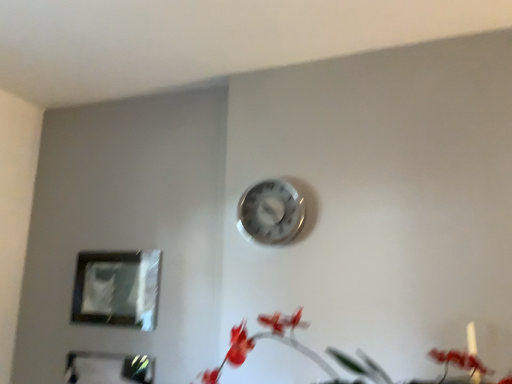
Question: Is matte plastic picture frame at lower left, the first picture frame positioned from the top, inside or outside of metallic reflective frame at lower left, the 1th picture frame in the bottom-to-top sequence?

Choices:
 (A) outside
 (B) inside

Answer: (A)

Question: From their relative heights in the image, would you say matte plastic picture frame at lower left, the first picture frame positioned from the top, is taller or shorter than metallic reflective frame at lower left, placed as the 2th picture frame when sorted from top to bottom?

Choices:
 (A) tall
 (B) short

Answer: (A)

Question: Which of these objects is positioned closest to the matte plastic picture frame at lower left, which appears as the 2th picture frame when ordered from the bottom?

Choices:
 (A) matte red flowers at lower right
 (B) metallic silver clock at upper center
 (C) metallic reflective frame at lower left, the 1th picture frame in the bottom-to-top sequence

Answer: (C)

Question: Estimate the real-world distances between objects in this image. Which object is closer to the matte plastic picture frame at lower left, the first picture frame positioned from the top?

Choices:
 (A) metallic silver clock at upper center
 (B) metallic reflective frame at lower left, the 1th picture frame in the bottom-to-top sequence
 (C) matte red flowers at lower right

Answer: (B)